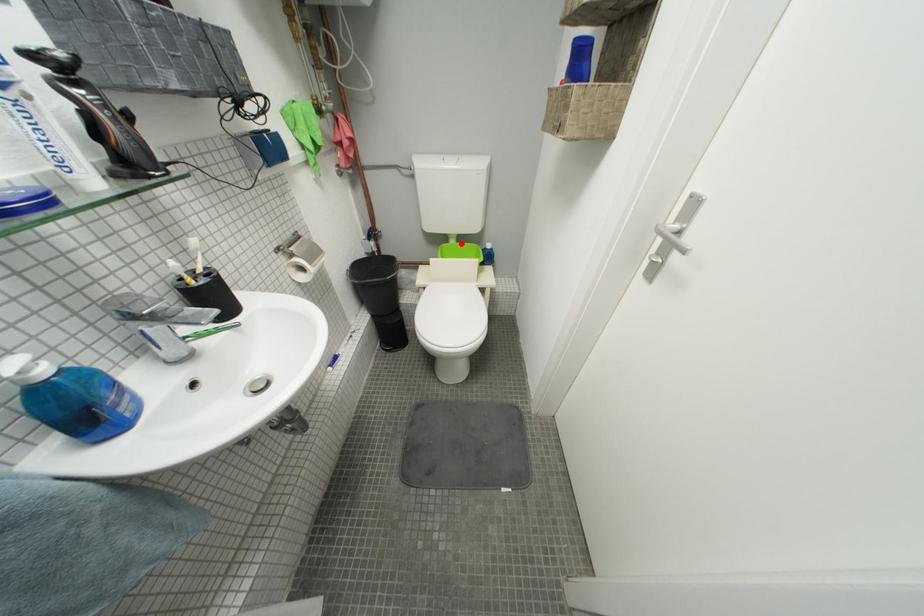
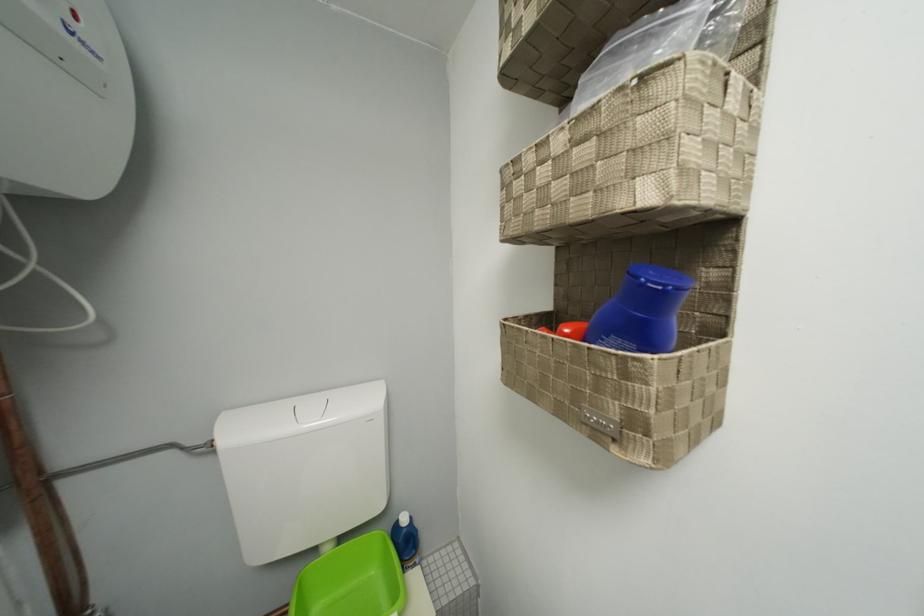
Locate, in the second image, the point that corresponds to the highlighted location in the first image.

(335, 552)